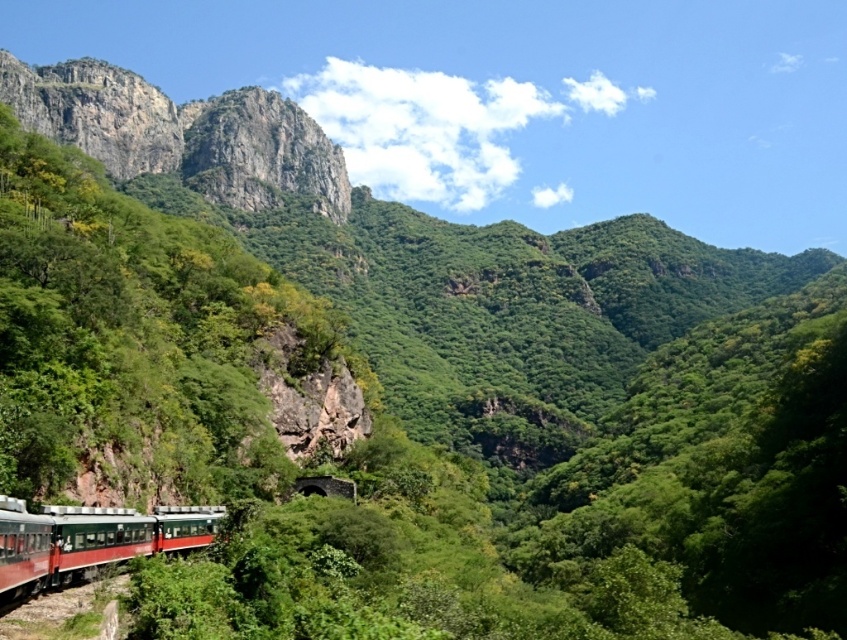
Is rugged stone mountain at upper left taller than metallic green train at lower left?

Correct, rugged stone mountain at upper left is much taller as metallic green train at lower left.

Which of these two, rugged stone mountain at upper left or metallic green train at lower left, stands taller?

With more height is rugged stone mountain at upper left.

The image size is (847, 640). What are the coordinates of `rugged stone mountain at upper left` in the screenshot? It's located at (181, 132).